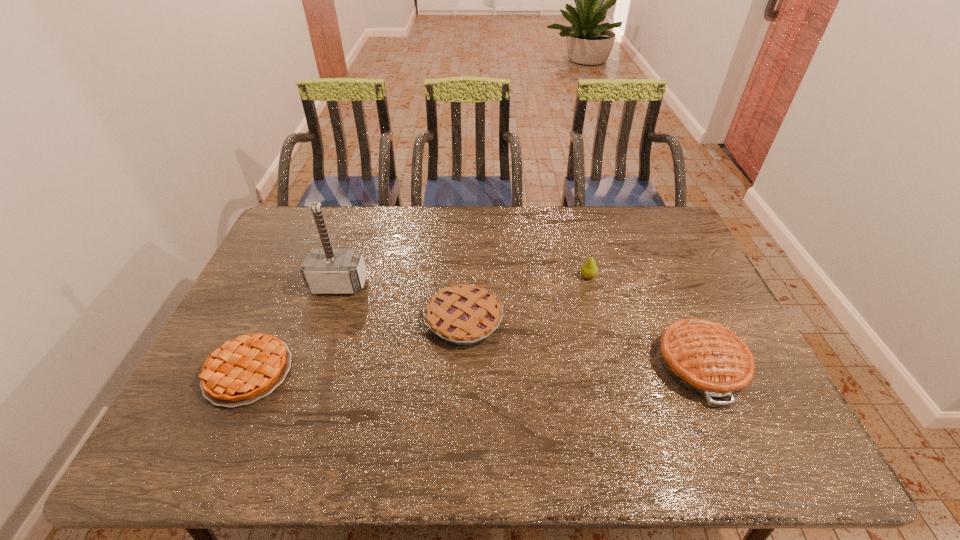
Locate an element on the screen. Image resolution: width=960 pixels, height=540 pixels. the tallest object is located at coordinates (325, 271).

Find the location of a particular element. The image size is (960, 540). pear is located at coordinates (589, 270).

This screenshot has width=960, height=540. I want to click on the rightmost object, so [x=708, y=359].

Where is `the rightmost pie`? the rightmost pie is located at coordinates (708, 359).

Find the location of a particular element. the second shortest pie is located at coordinates (464, 314).

The image size is (960, 540). What are the coordinates of `the second pie from left to right` in the screenshot? It's located at (464, 314).

Image resolution: width=960 pixels, height=540 pixels. Identify the location of the shortest object. (243, 370).

This screenshot has width=960, height=540. In order to click on the shortest pie in this screenshot , I will do `click(243, 370)`.

Image resolution: width=960 pixels, height=540 pixels. Find the location of `free space located 0.090m for striking with the head of the hammer`. free space located 0.090m for striking with the head of the hammer is located at coordinates (327, 319).

In order to click on vacant point located on the front of the pear in this screenshot , I will do `click(593, 298)`.